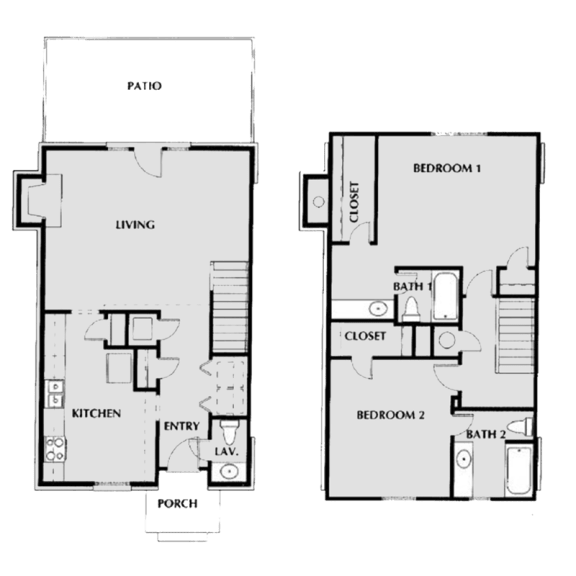
Where is `bathrooms`? bathrooms is located at coordinates (413, 290), (488, 435).